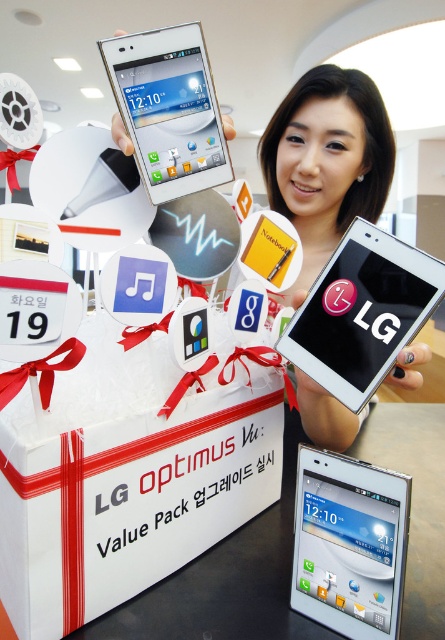
Question: Which point is closer to the camera?

Choices:
 (A) smooth skin at center
 (B) white cardboard box at center
 (C) white glossy smartphone at upper center

Answer: (B)

Question: Where is smooth skin at center located in relation to white glossy smartphone at center in the image?

Choices:
 (A) above
 (B) below

Answer: (A)

Question: Is white glossy smartphone at center bigger than white glossy smartphone at upper center?

Choices:
 (A) yes
 (B) no

Answer: (B)

Question: Among these objects, which one is farthest from the camera?

Choices:
 (A) white cardboard box at center
 (B) white glossy smartphone at center
 (C) white glossy phone at center
 (D) white glossy smartphone at upper center

Answer: (B)

Question: Which object is positioned farthest from the white cardboard box at center?

Choices:
 (A) white glossy smartphone at center
 (B) white glossy phone at center
 (C) white glossy smartphone at upper center

Answer: (C)

Question: Does smooth skin at center have a smaller size compared to white glossy smartphone at center?

Choices:
 (A) no
 (B) yes

Answer: (A)